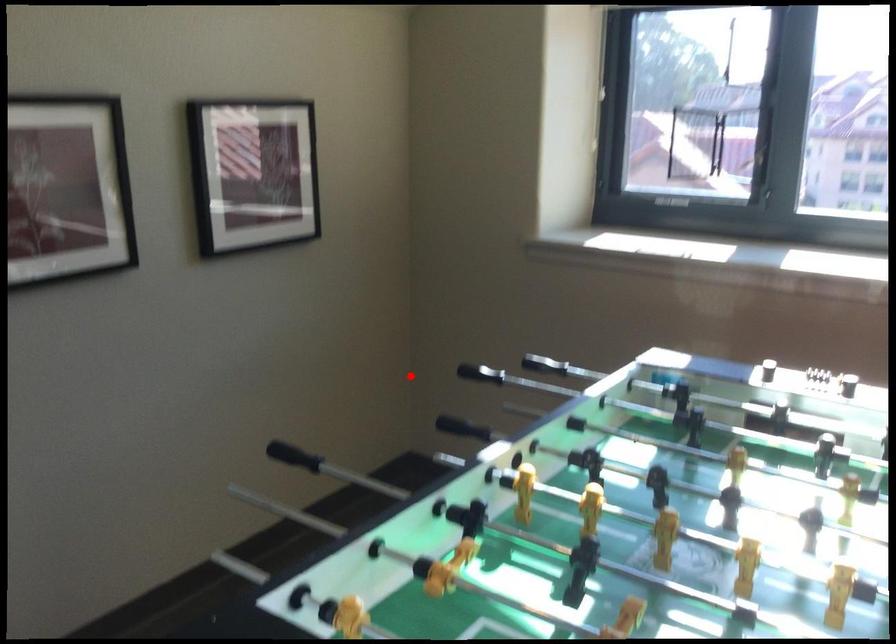
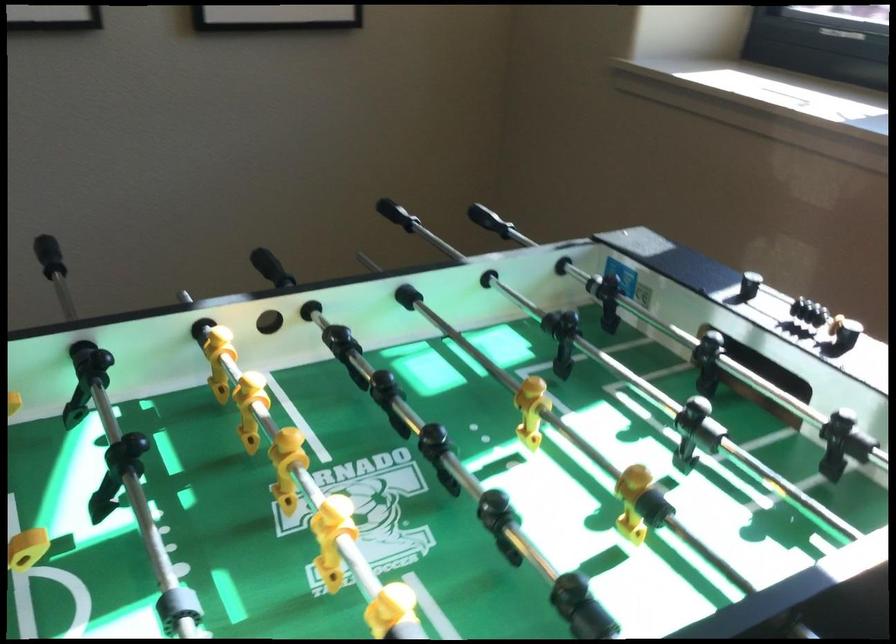
Locate, in the second image, the point that corresponds to the highlighted location in the first image.

(488, 220)